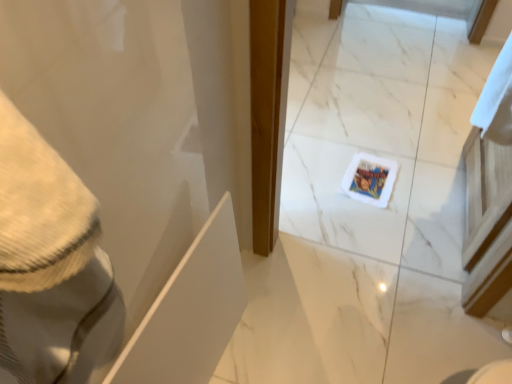
Find the location of a particular element. free point above white plastic container at center (from a real-world perspective) is located at coordinates (368, 184).